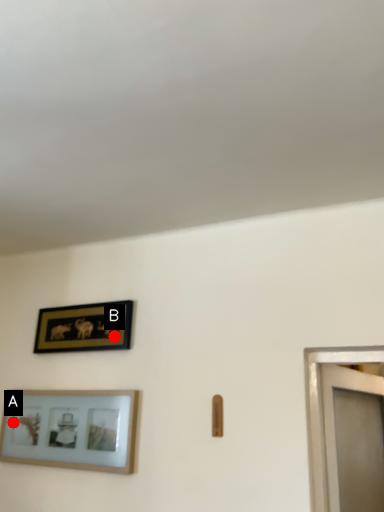
Question: Two points are circled on the image, labeled by A and B beside each circle. Which point appears farthest from the camera in this image?

Choices:
 (A) A is further
 (B) B is further

Answer: (A)